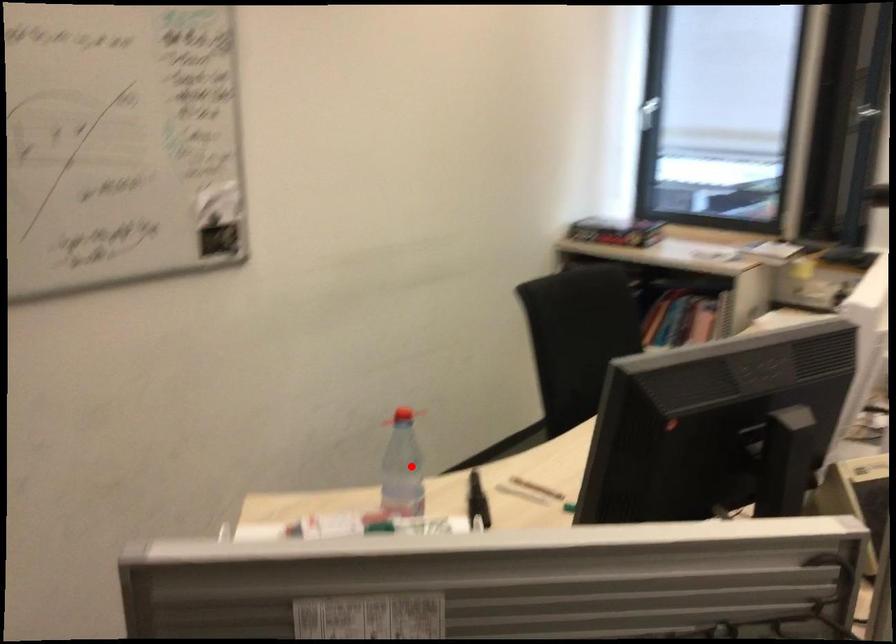
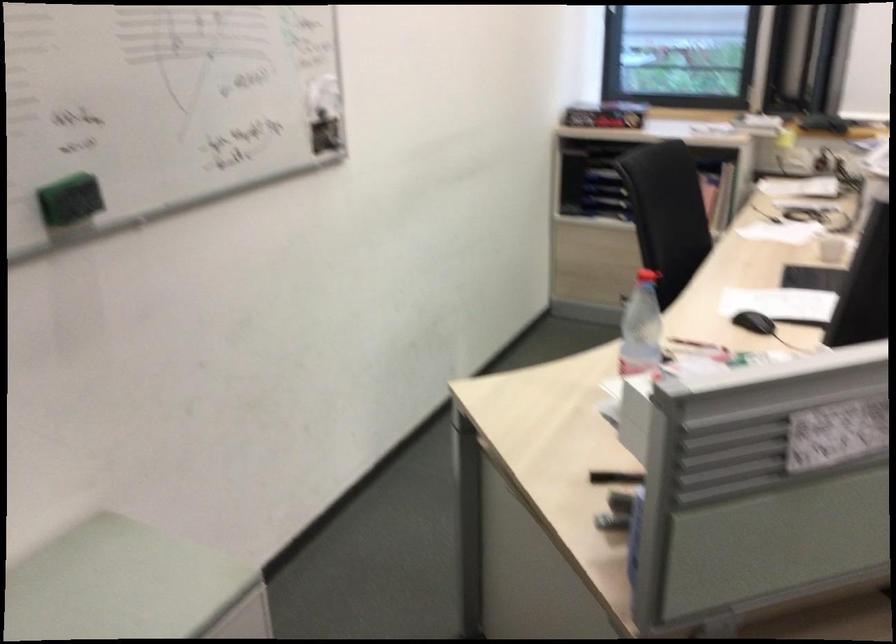
Find the pixel in the second image that matches the highlighted location in the first image.

(641, 327)